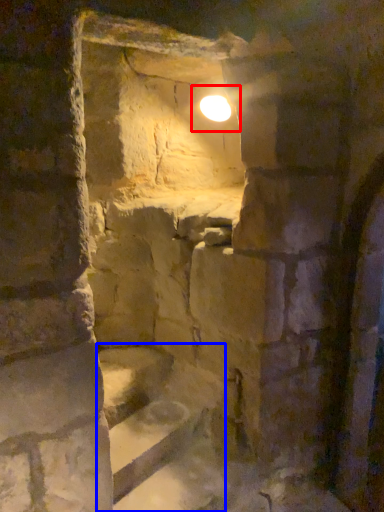
Question: Which object appears closest to the camera in this image, light (highlighted by a red box) or stairs (highlighted by a blue box)?

Choices:
 (A) light
 (B) stairs

Answer: (B)